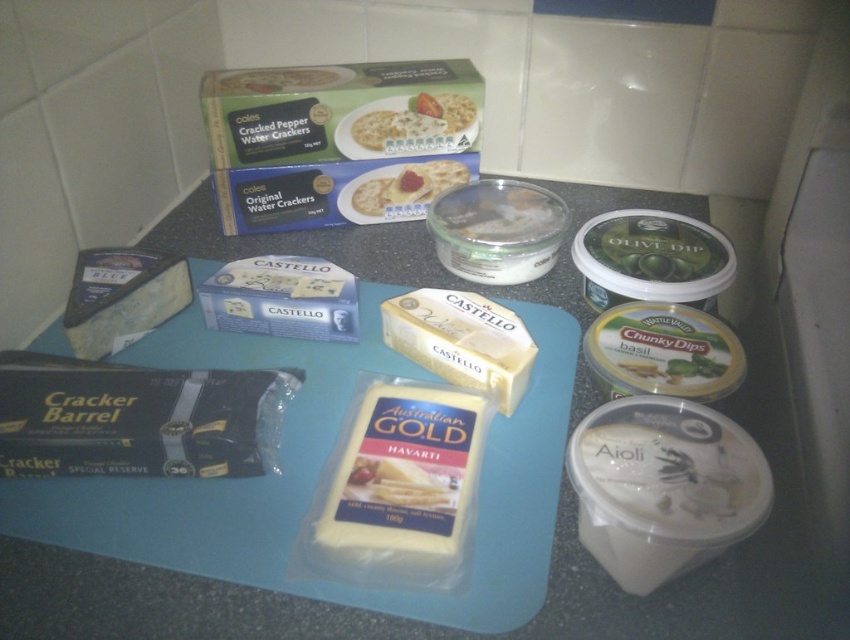
Question: Which point appears closest to the camera in this image?

Choices:
 (A) coord(157,276)
 (B) coord(338,506)
 (C) coord(429,125)
 (D) coord(88,609)

Answer: (D)

Question: Which point appears farthest from the camera in this image?

Choices:
 (A) (418, 529)
 (B) (629, 465)

Answer: (A)

Question: Does white creamy aioli at bottom right appear on the left side of blue creamy cheese at lower left?

Choices:
 (A) no
 (B) yes

Answer: (A)

Question: From the image, what is the correct spatial relationship of white creamy havarti at center in relation to matte white crackers at center?

Choices:
 (A) below
 (B) above

Answer: (A)

Question: Estimate the real-world distances between objects in this image. Which object is closer to the white creamy havarti at center?

Choices:
 (A) white cracker at upper center
 (B) blue creamy cheese at lower left
 (C) blue plastic cutting board at center
 (D) white creamy aioli at bottom right

Answer: (D)

Question: In this image, where is blue plastic cutting board at center located relative to white creamy aioli at bottom right?

Choices:
 (A) below
 (B) above

Answer: (B)